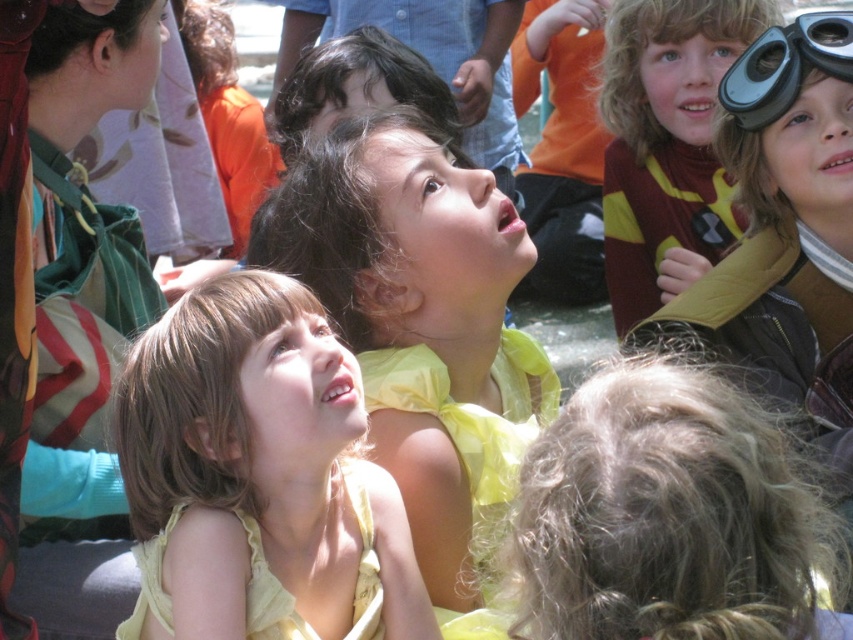
Question: Is yellow fabric dress at center wider than matte brown sweater at upper right?

Choices:
 (A) no
 (B) yes

Answer: (B)

Question: Which point appears farthest from the camera in this image?

Choices:
 (A) (326, 157)
 (B) (622, 326)

Answer: (B)

Question: Does yellow fabric dress at center appear on the right side of yellow satin dress at center?

Choices:
 (A) yes
 (B) no

Answer: (B)

Question: Which point is farther to the camera?

Choices:
 (A) matte brown sweater at upper right
 (B) black rubber goggles at upper right
 (C) yellow satin dress at center
 (D) yellow fabric dress at center

Answer: (A)

Question: Does yellow fabric dress at center have a smaller size compared to black rubber goggles at upper right?

Choices:
 (A) no
 (B) yes

Answer: (A)

Question: Which point appears closest to the camera in this image?

Choices:
 (A) (222, 509)
 (B) (822, 70)
 (C) (408, 330)

Answer: (A)